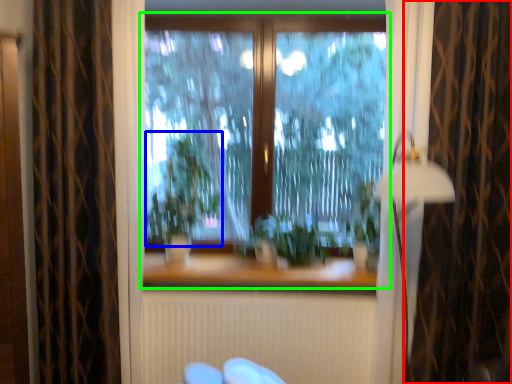
Question: Considering the real-world distances, which object is closest to curtain (highlighted by a red box)? plant (highlighted by a blue box) or window (highlighted by a green box).

Choices:
 (A) plant
 (B) window

Answer: (B)